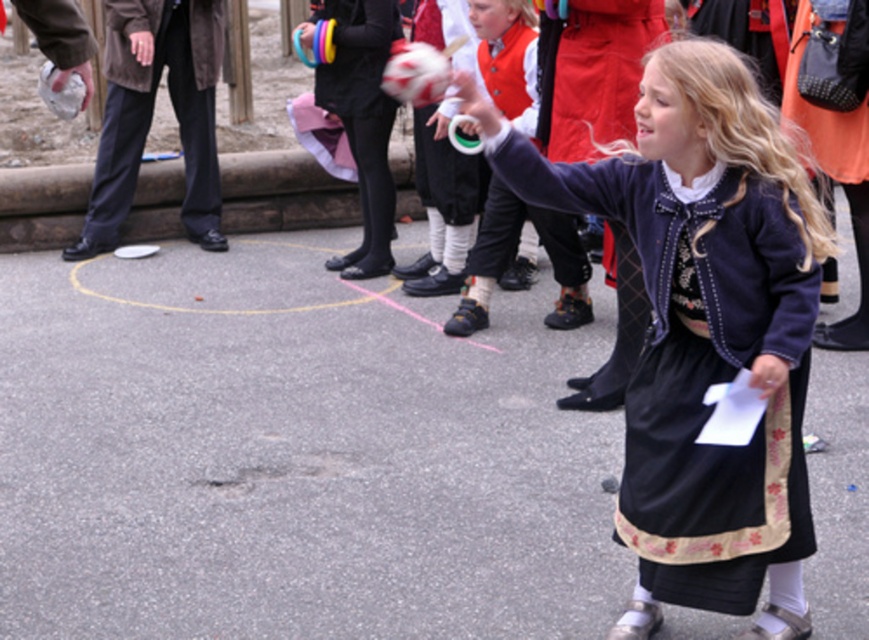
Describe the element at coordinates (702, 330) in the screenshot. I see `matte blue dress at center` at that location.

Does matte blue dress at center appear over matte black shoes at center?

Incorrect, matte blue dress at center is not positioned above matte black shoes at center.

Locate an element on the screen. The height and width of the screenshot is (640, 869). matte blue dress at center is located at coordinates (702, 330).